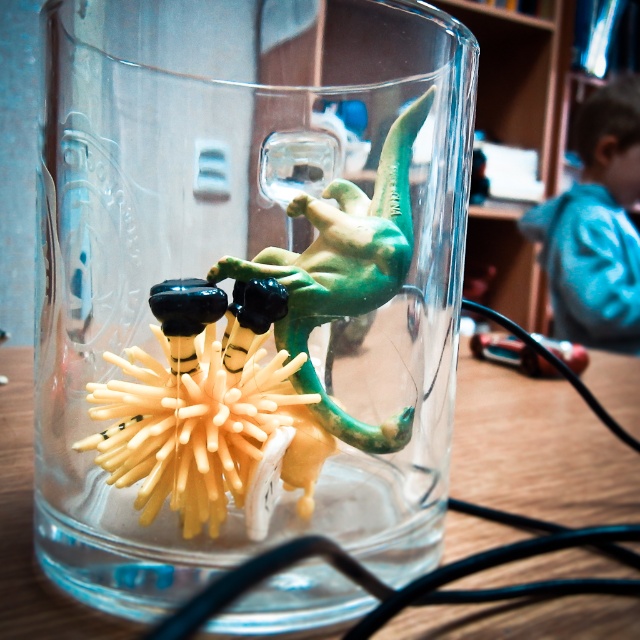
Consider the image. You are trying to reach for the transparent glass jar at center and the wooden table at center. Which object will your hand touch first?

The transparent glass jar at center is closer to the viewer than the wooden table at center, so your hand will touch the transparent glass jar at center first.

You are a child who wants to place a sticker on the transparent glass jar at center. The sticker is 2 cm wide. The coordinates of the jar are marked at point (248, 285). Can you fit the sticker on the jar without covering the alien figurine?

The point (248, 285) marks the transparent glass jar at center, so yes, you can place the sticker on the jar as long as it is within the jar area and not overlapping the alien figurine.

Looking at this image, you are arranging items on a shelf and need to place the transparent glass jar at center and the blue denim shirt at upper right. According to the image, which object is positioned to the left side?

The transparent glass jar at center is to the left of blue denim shirt at upper right, so the transparent glass jar at center is positioned to the left side.